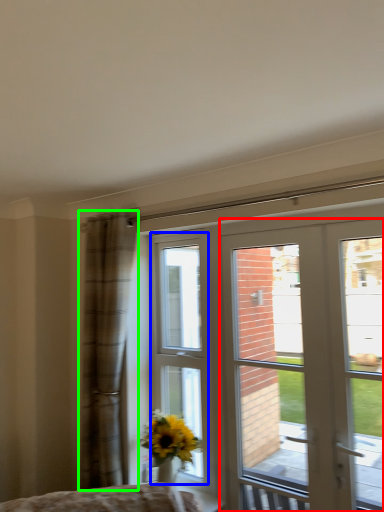
Question: Based on their relative distances, which object is farther from door (highlighted by a red box)? Choose from bay window (highlighted by a blue box) and curtain (highlighted by a green box).

Choices:
 (A) bay window
 (B) curtain

Answer: (A)